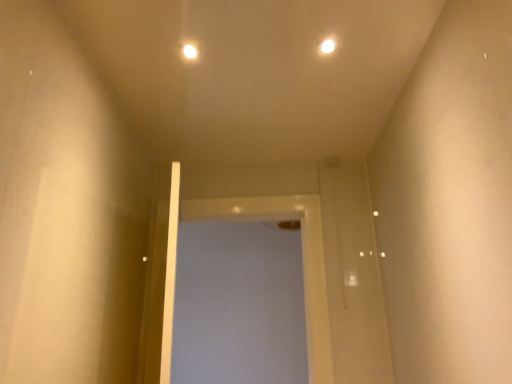
Question: Is white glossy light at upper center, the second light positioned from the right, in front of or behind white glossy screen door at center in the image?

Choices:
 (A) behind
 (B) front

Answer: (B)

Question: Considering the positions of white glossy light at upper center, the second light positioned from the right, and white glossy screen door at center in the image, is white glossy light at upper center, the second light positioned from the right, taller or shorter than white glossy screen door at center?

Choices:
 (A) tall
 (B) short

Answer: (B)

Question: Estimate the real-world distances between objects in this image. Which object is closer to the white glossy light at upper center, the second light positioned from the right?

Choices:
 (A) white glossy light at upper center, the 2th light in the left-to-right sequence
 (B) white glossy screen door at center

Answer: (A)

Question: Estimate the real-world distances between objects in this image. Which object is farther from the white glossy light at upper center, the 2th light in the left-to-right sequence?

Choices:
 (A) white glossy screen door at center
 (B) white glossy light at upper center, the second light positioned from the right

Answer: (A)